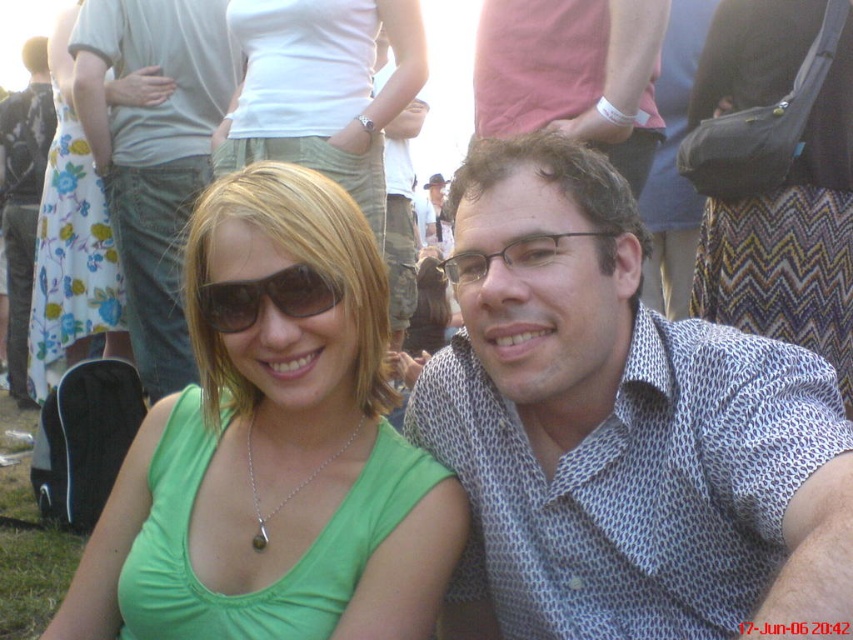
Is matte pink shirt at upper center below matte black hat at upper center?

Yes.

Is matte pink shirt at upper center shorter than matte black hat at upper center?

Yes.

Where is `matte pink shirt at upper center`? matte pink shirt at upper center is located at coordinates (573, 74).

Image resolution: width=853 pixels, height=640 pixels. What are the coordinates of `matte pink shirt at upper center` in the screenshot? It's located at (573, 74).

Is floral cotton skirt at left in front of matte black sunglasses at center?

No, floral cotton skirt at left is further to the viewer.

Does floral cotton skirt at left come behind matte black sunglasses at center?

Yes, it is.

Is point (74, 189) positioned after point (213, 310)?

Yes, point (74, 189) is behind point (213, 310).

You are a GUI agent. You are given a task and a screenshot of the screen. Output one action in this format:
    pyautogui.click(x=<x>, y=<y>)
    Task: Click on the floral cotton skirt at left
    The width and height of the screenshot is (853, 640).
    Given the screenshot: What is the action you would take?
    pyautogui.click(x=71, y=243)

Is matte gray shirt at center to the left of matte black hat at upper center from the viewer's perspective?

Indeed, matte gray shirt at center is positioned on the left side of matte black hat at upper center.

From the picture: Does matte gray shirt at center appear over matte black hat at upper center?

No.

Is point (120, 256) farther from camera compared to point (421, 196)?

No, (120, 256) is closer to viewer.

Find the location of a particular element. The width and height of the screenshot is (853, 640). matte gray shirt at center is located at coordinates (154, 154).